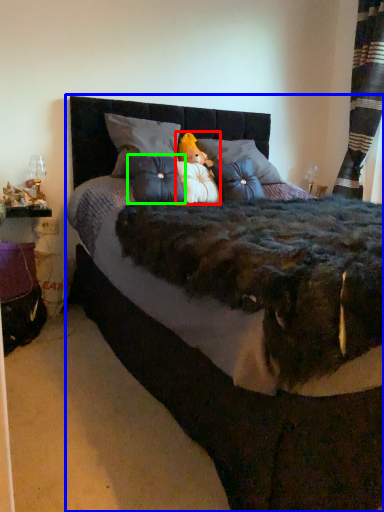
Question: Considering the real-world distances, which object is farthest from toy (highlighted by a red box)? bed (highlighted by a blue box) or throw pillow (highlighted by a green box)?

Choices:
 (A) bed
 (B) throw pillow

Answer: (A)